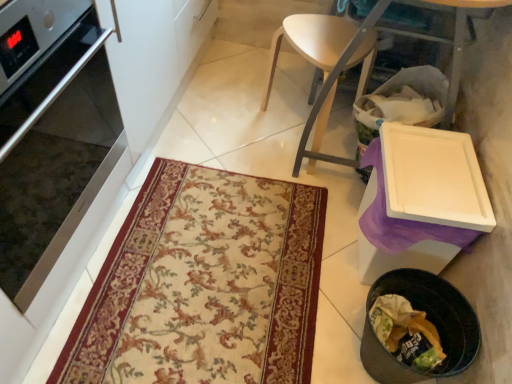
You are a GUI agent. You are given a task and a screenshot of the screen. Output one action in this format:
    pyautogui.click(x=<x>, y=<y>)
    Task: Click on the vacant space underneath beige floral rug at center (from a real-world perspective)
    This screenshot has width=512, height=384.
    Given the screenshot: What is the action you would take?
    pyautogui.click(x=209, y=261)